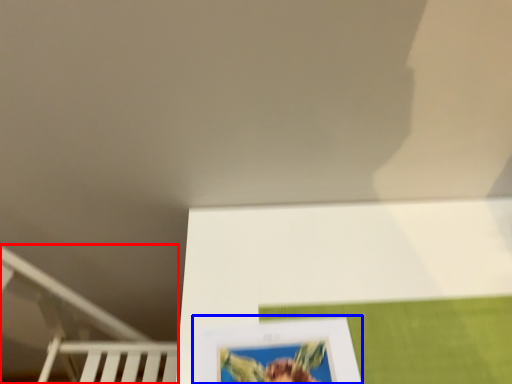
Question: Which object appears farthest to the camera in this image, bunk bed (highlighted by a red box) or picture frame (highlighted by a blue box)?

Choices:
 (A) bunk bed
 (B) picture frame

Answer: (A)